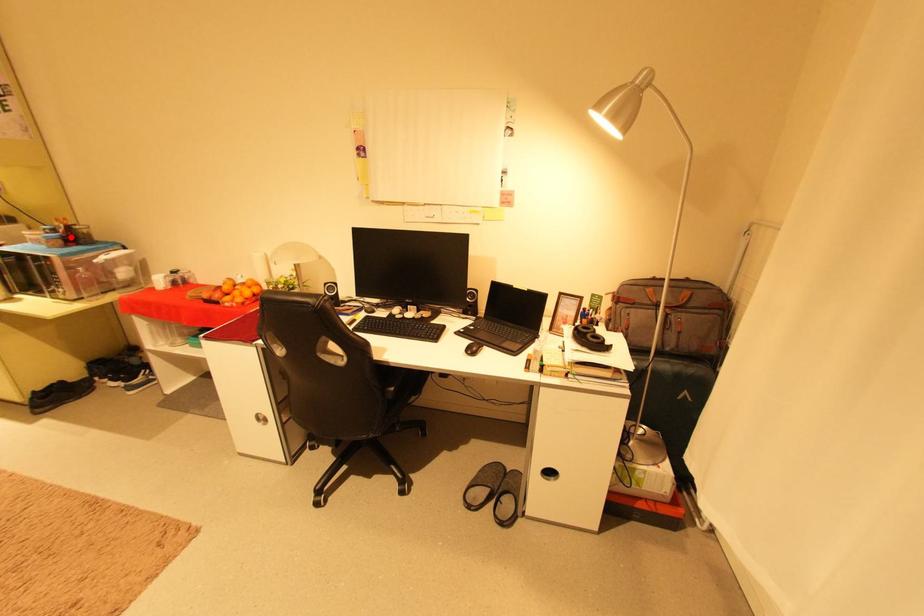
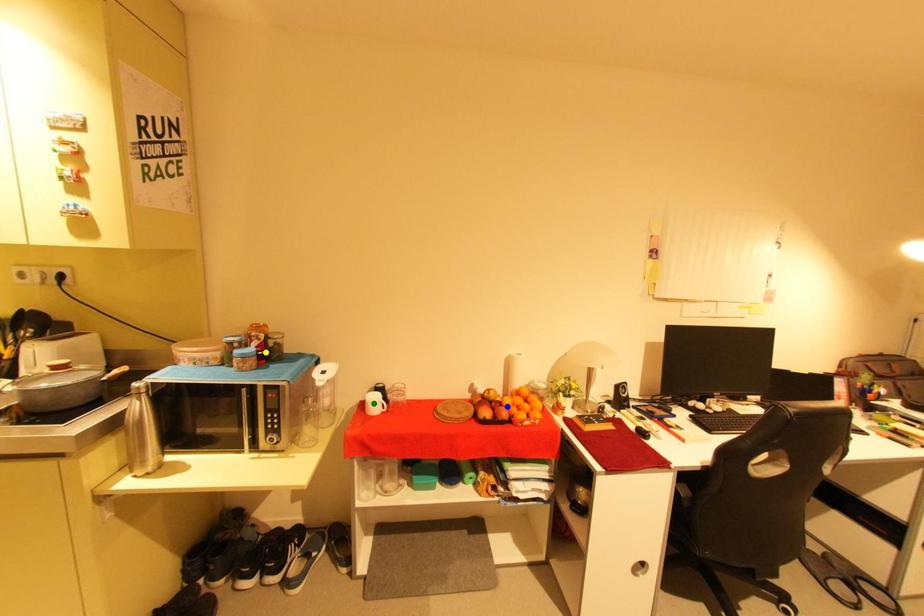
Question: I am providing you with two images of the same scene from different viewpoints. A red point is marked on the first image. You are given multiple points on the second image. Which point in image 2 represents the same 3d spot as the red point in image 1?

Choices:
 (A) yellow point
 (B) green point
 (C) blue point

Answer: (A)